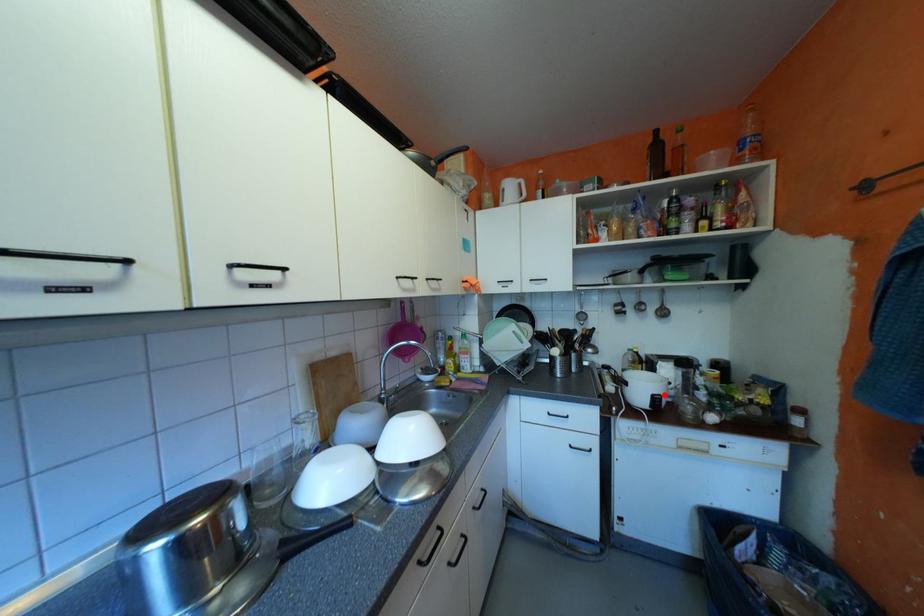
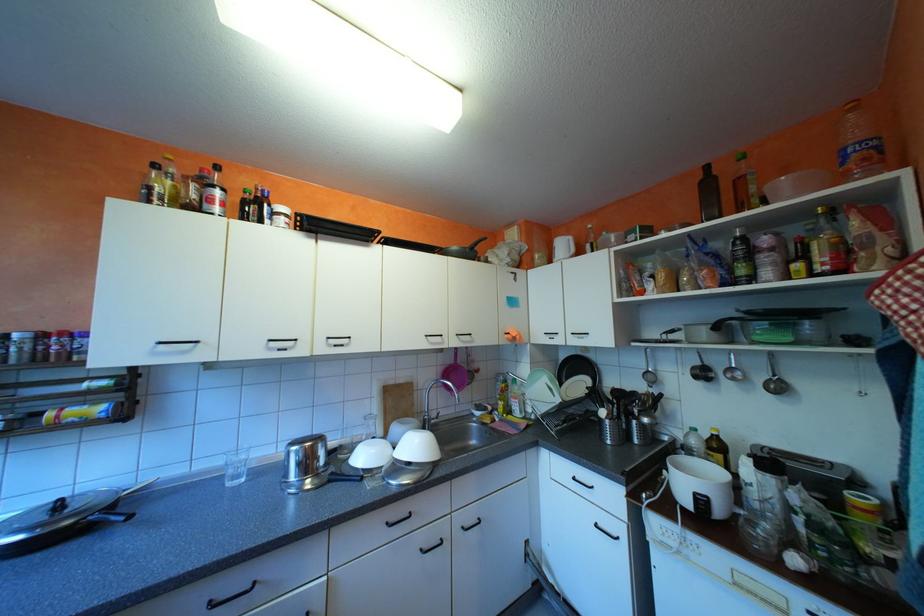
In the second image, find the point that corresponds to the highlighted location in the first image.

(708, 493)